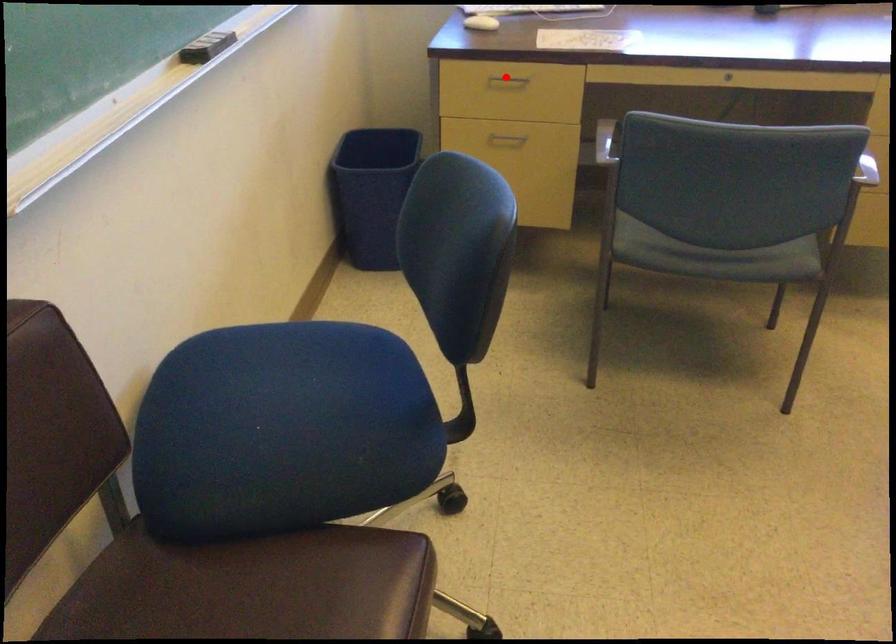
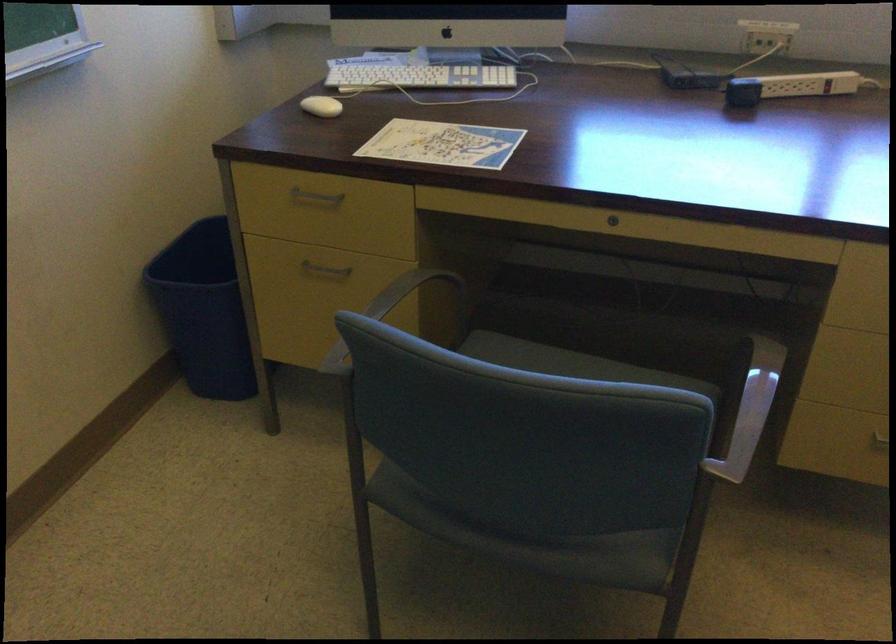
Locate, in the second image, the point that corresponds to the highlighted location in the first image.

(315, 196)